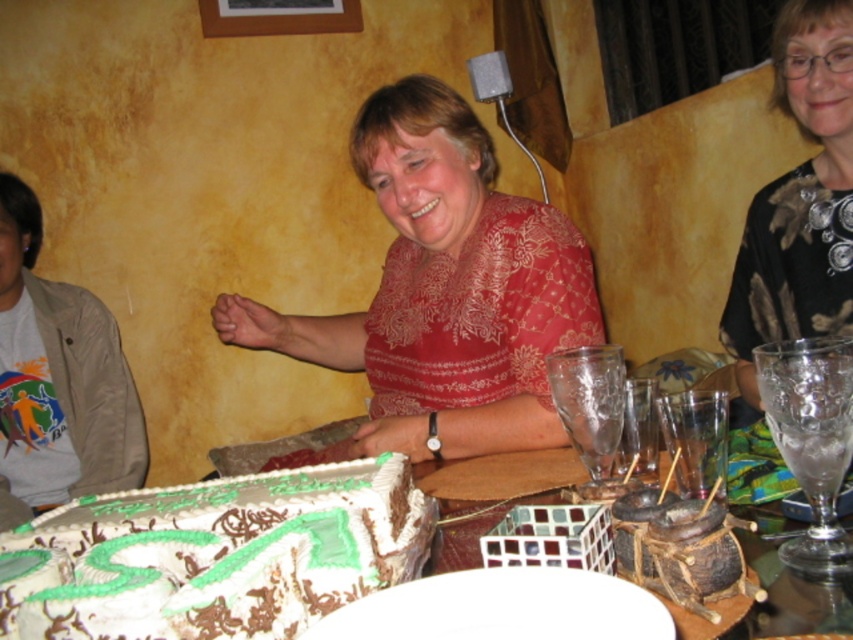
Question: Which point appears closest to the camera in this image?

Choices:
 (A) (300, 563)
 (B) (210, 513)
 (C) (566, 280)
 (D) (78, 467)

Answer: (A)

Question: Does matte floral blouse at center have a larger size compared to black textured blouse at upper right?

Choices:
 (A) no
 (B) yes

Answer: (B)

Question: Does white glossy cake at center lie in front of dark brown textured chocolate cake at lower right?

Choices:
 (A) yes
 (B) no

Answer: (A)

Question: Considering the real-world distances, which object is farthest from the matte floral blouse at center?

Choices:
 (A) beige cotton jacket at left
 (B) white glossy cake at center
 (C) white frosted cake at center
 (D) dark brown textured chocolate cake at lower right

Answer: (A)

Question: Does white frosted cake at center appear under black textured blouse at upper right?

Choices:
 (A) no
 (B) yes

Answer: (B)

Question: Which object is closer to the camera taking this photo?

Choices:
 (A) matte floral blouse at center
 (B) white glossy cake at center
 (C) white frosted cake at center

Answer: (C)